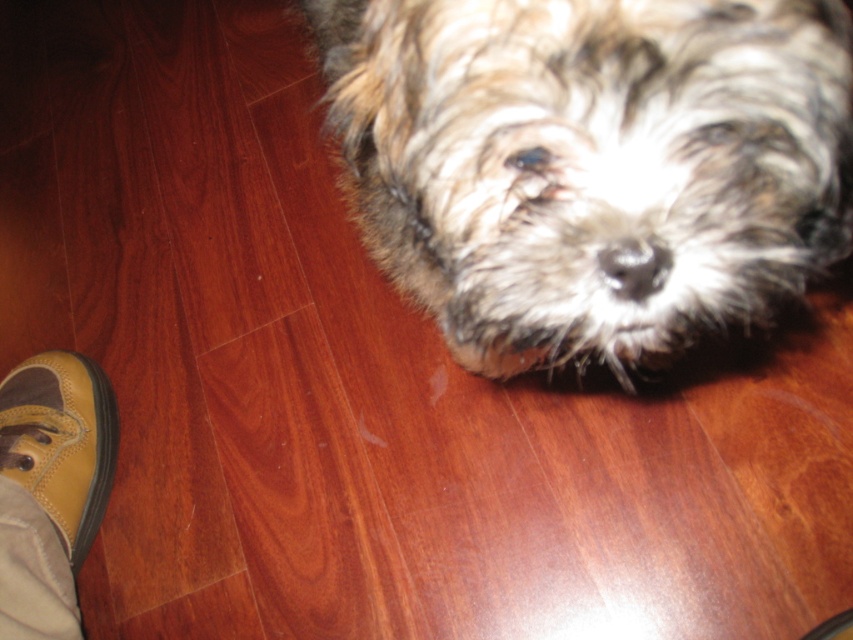
You are a photographer trying to capture a close shot of the fuzzy brown dog at center and the tan suede shoe at lower left. Since you want both subjects to be in focus, which one should you adjust your camera focus to prioritize?

The fuzzy brown dog at center is bigger than the tan suede shoe at lower left, so you should prioritize focusing on the fuzzy brown dog at center to ensure both are in focus.

You are a photographer trying to capture a close shot of the fuzzy brown dog at center. However, the tan suede shoe at lower left might block your view. Based on their positions, will the shoe interfere with your photo?

The fuzzy brown dog at center is closer to the viewer than the tan suede shoe at lower left, so the dog will block the view of the shoe in the photo, preventing interference.

You are a service robot in a home. You need to move a small toy from the fuzzy brown dog at center to the tan suede shoe at lower left. What is the shortest distance you need to travel to complete this task?

The shortest distance you need to travel is 89.78 centimeters between the fuzzy brown dog at center and the tan suede shoe at lower left.